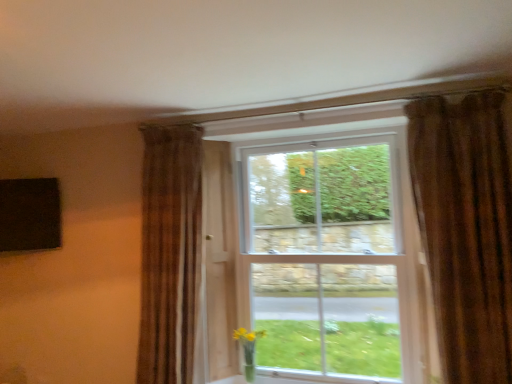
Question: Considering the relative sizes of brown textured curtain at left, positioned as the first curtain in back-to-front order, and translucent glass vase at lower right in the image provided, is brown textured curtain at left, positioned as the first curtain in back-to-front order, shorter than translucent glass vase at lower right?

Choices:
 (A) no
 (B) yes

Answer: (A)

Question: From a real-world perspective, is brown textured curtain at left, which is the second curtain from front to back, positioned under translucent glass vase at lower right based on gravity?

Choices:
 (A) yes
 (B) no

Answer: (B)

Question: Would you say translucent glass vase at lower right is part of brown textured curtain at left, marked as the first curtain in a left-to-right arrangement,'s contents?

Choices:
 (A) yes
 (B) no

Answer: (B)

Question: Considering the relative positions of brown textured curtain at left, which appears as the second curtain when viewed from the right, and translucent glass vase at lower right in the image provided, is brown textured curtain at left, which appears as the second curtain when viewed from the right, to the left of translucent glass vase at lower right from the viewer's perspective?

Choices:
 (A) yes
 (B) no

Answer: (A)

Question: Is brown textured curtain at left, which is the second curtain from front to back, in contact with translucent glass vase at lower right?

Choices:
 (A) no
 (B) yes

Answer: (A)

Question: In terms of height, does brown textured curtain at left, which is the second curtain from front to back, look taller or shorter compared to white glass window at center?

Choices:
 (A) short
 (B) tall

Answer: (A)

Question: From a real-world perspective, is brown textured curtain at left, positioned as the first curtain in back-to-front order, above or below white glass window at center?

Choices:
 (A) above
 (B) below

Answer: (A)

Question: In terms of width, does brown textured curtain at left, positioned as the first curtain in back-to-front order, look wider or thinner when compared to white glass window at center?

Choices:
 (A) wide
 (B) thin

Answer: (A)

Question: From the image's perspective, is brown textured curtain at left, which is the second curtain from front to back, above or below white glass window at center?

Choices:
 (A) below
 (B) above

Answer: (B)

Question: Considering the positions of point click(246, 331) and point click(276, 153), is point click(246, 331) closer or farther from the camera than point click(276, 153)?

Choices:
 (A) closer
 (B) farther

Answer: (A)

Question: Considering the relative positions of translucent glass vase at lower right and white glass window at center in the image provided, is translucent glass vase at lower right to the left or to the right of white glass window at center?

Choices:
 (A) right
 (B) left

Answer: (B)

Question: In terms of width, does translucent glass vase at lower right look wider or thinner when compared to white glass window at center?

Choices:
 (A) wide
 (B) thin

Answer: (A)

Question: From their relative heights in the image, would you say translucent glass vase at lower right is taller or shorter than white glass window at center?

Choices:
 (A) short
 (B) tall

Answer: (A)

Question: Considering their positions, is brown textured curtain at left, which appears as the second curtain when viewed from the right, located in front of or behind translucent glass vase at lower right?

Choices:
 (A) front
 (B) behind

Answer: (A)

Question: Is point (158, 307) closer or farther from the camera than point (252, 336)?

Choices:
 (A) closer
 (B) farther

Answer: (A)